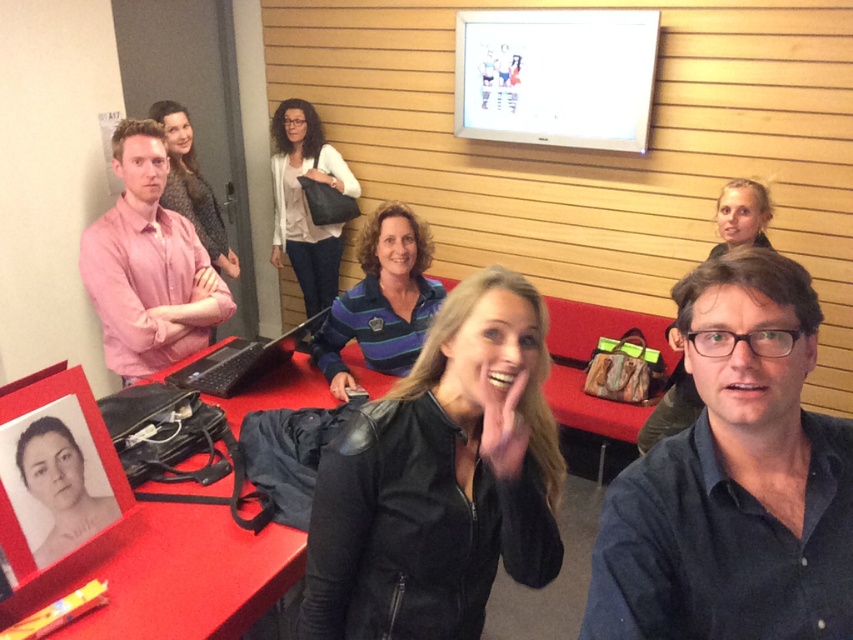
Question: Which point is closer to the camera?

Choices:
 (A) smooth blonde hair at upper right
 (B) striped polo shirt at center

Answer: (B)

Question: Estimate the real-world distances between objects in this image. Which object is farther from the matte black jacket at upper right?

Choices:
 (A) black leather jacket at center
 (B) smooth blonde hair at upper right

Answer: (A)

Question: Does matte pink sweater at center have a smaller size compared to smooth blonde hair at upper right?

Choices:
 (A) no
 (B) yes

Answer: (A)

Question: Which object appears farthest from the camera in this image?

Choices:
 (A) black leather jacket at center
 (B) matte black jacket at upper right
 (C) pink matte shirt at left
 (D) dark blue shirt at center

Answer: (B)

Question: Can you confirm if pink matte shirt at left is positioned to the left of patterned fabric dress at center?

Choices:
 (A) no
 (B) yes

Answer: (A)

Question: Does red leather table at center appear under matte pink sweater at center?

Choices:
 (A) no
 (B) yes

Answer: (B)